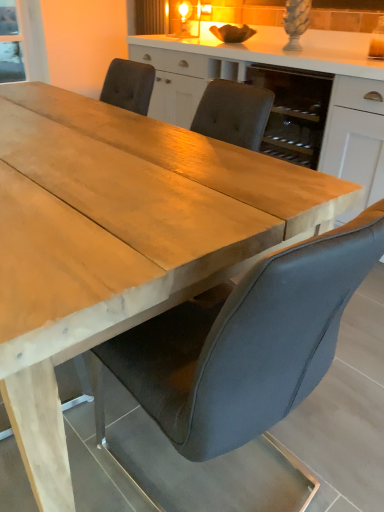
Question: Is white matte cabinet at center oriented towards suede gray chair at center?

Choices:
 (A) yes
 (B) no

Answer: (A)

Question: Is white matte cabinet at center to the right of suede gray chair at center from the viewer's perspective?

Choices:
 (A) yes
 (B) no

Answer: (A)

Question: Would you say white matte cabinet at center is outside suede gray chair at center?

Choices:
 (A) no
 (B) yes

Answer: (B)

Question: From the image's perspective, is white matte cabinet at center on suede gray chair at center?

Choices:
 (A) yes
 (B) no

Answer: (A)

Question: Is white matte cabinet at center wider than suede gray chair at center?

Choices:
 (A) yes
 (B) no

Answer: (A)

Question: Is white matte cabinet at center bigger than suede gray chair at center?

Choices:
 (A) yes
 (B) no

Answer: (A)

Question: Is the position of suede gray chair at center more distant than that of white matte cabinet at center?

Choices:
 (A) yes
 (B) no

Answer: (B)

Question: Could you tell me if suede gray chair at center is facing white matte cabinet at center?

Choices:
 (A) no
 (B) yes

Answer: (A)

Question: Can you confirm if suede gray chair at center is taller than white matte cabinet at center?

Choices:
 (A) no
 (B) yes

Answer: (A)

Question: From a real-world perspective, is suede gray chair at center located beneath white matte cabinet at center?

Choices:
 (A) yes
 (B) no

Answer: (A)

Question: Does suede gray chair at center have a larger size compared to white matte cabinet at center?

Choices:
 (A) no
 (B) yes

Answer: (A)

Question: From a real-world perspective, is suede gray chair at center positioned over white matte cabinet at center based on gravity?

Choices:
 (A) yes
 (B) no

Answer: (B)

Question: Considering the positions of point (375, 187) and point (200, 345), is point (375, 187) closer or farther from the camera than point (200, 345)?

Choices:
 (A) closer
 (B) farther

Answer: (B)